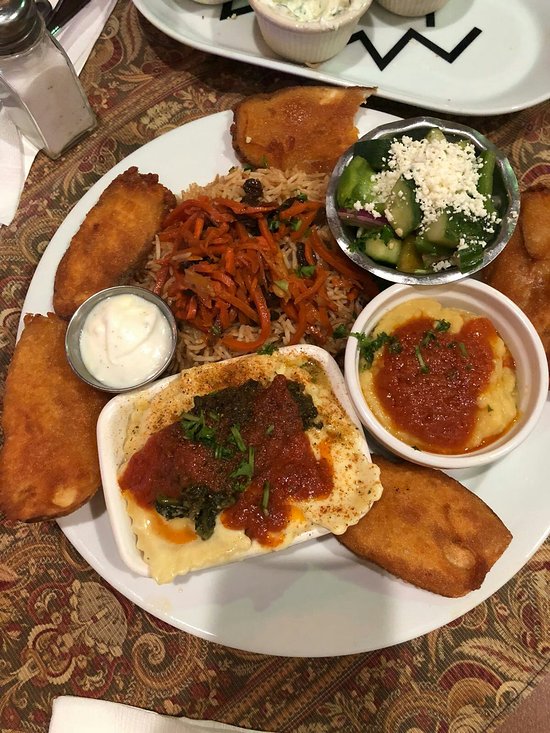
Locate an element on the screen. This screenshot has height=733, width=550. tablecloth is located at coordinates coord(468,685).